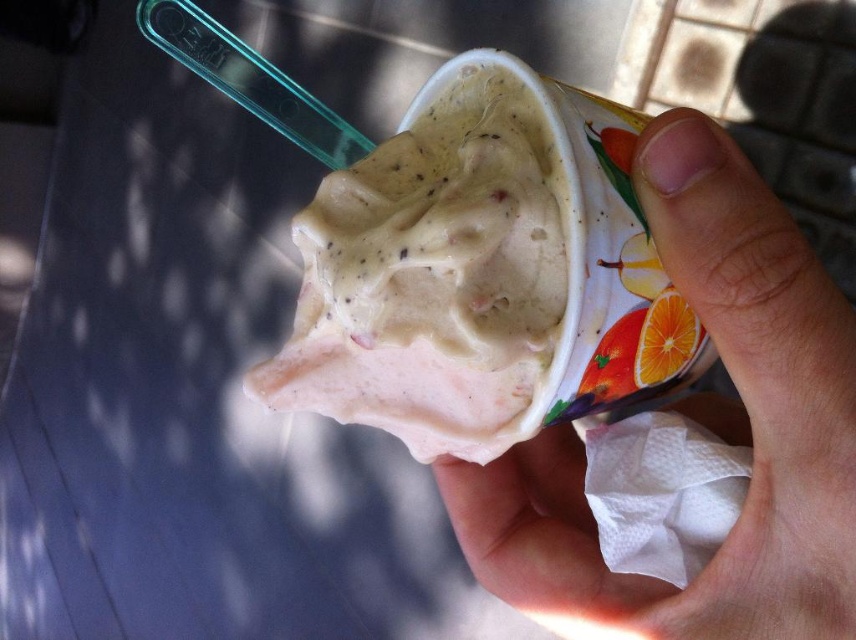
Describe the element at coordinates (702, 424) in the screenshot. I see `smooth skin hand at center` at that location.

Between smooth skin hand at center and orange matte at upper right, which one appears on the left side from the viewer's perspective?

orange matte at upper right is more to the left.

Find the location of a particular element. Image resolution: width=856 pixels, height=640 pixels. smooth skin hand at center is located at coordinates (702, 424).

Between whipped cream at center and orange matte at upper right, which one appears on the left side from the viewer's perspective?

whipped cream at center is more to the left.

This screenshot has height=640, width=856. Describe the element at coordinates (474, 269) in the screenshot. I see `whipped cream at center` at that location.

Who is more forward, (533, 198) or (664, 337)?

Point (533, 198) is more forward.

Identify the location of whipped cream at center. (474, 269).

From the picture: Between whipped cream at center and smooth skin hand at center, which one has less height?

whipped cream at center is shorter.

Is whipped cream at center to the left of smooth skin hand at center from the viewer's perspective?

Yes, whipped cream at center is to the left of smooth skin hand at center.

This screenshot has height=640, width=856. Describe the element at coordinates (474, 269) in the screenshot. I see `whipped cream at center` at that location.

Locate an element on the screen. Image resolution: width=856 pixels, height=640 pixels. whipped cream at center is located at coordinates (474, 269).